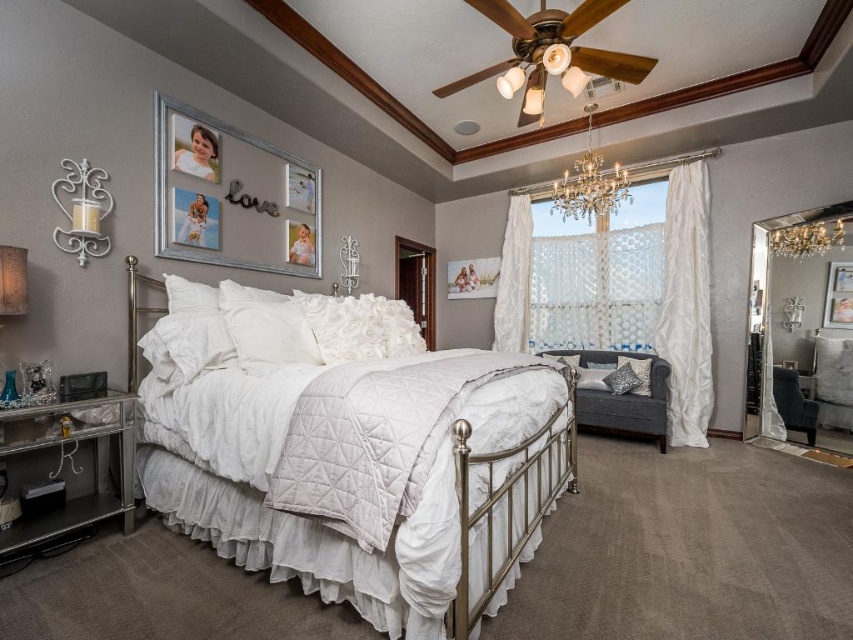
You are standing in the bedroom and want to place a new painting between the silver metallic picture frame at upper left and the matte gold ceiling fan at upper center. Based on their positions, where should you place the new painting?

You should place the new painting to the right of the silver metallic picture frame at upper left but to the left of the matte gold ceiling fan at upper center, since the silver metallic picture frame at upper left is positioned to the left of the matte gold ceiling fan at upper center.